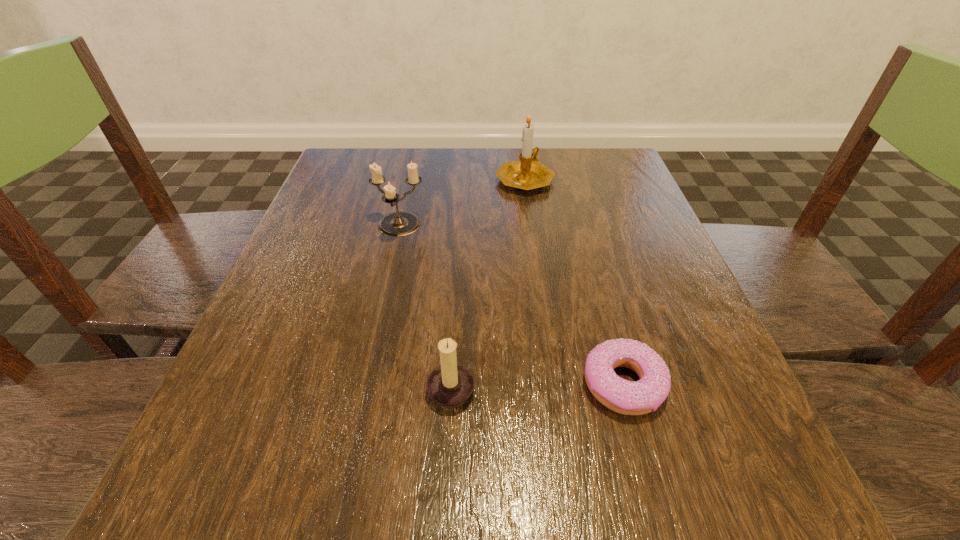
Identify the location of the tallest candle holder. The width and height of the screenshot is (960, 540). (526, 174).

The image size is (960, 540). Identify the location of the farthest candle holder. (526, 174).

Find the location of a particular element. Image resolution: width=960 pixels, height=540 pixels. the third shortest object is located at coordinates click(400, 223).

Where is `the second farthest object`? This screenshot has width=960, height=540. the second farthest object is located at coordinates (400, 223).

The height and width of the screenshot is (540, 960). In order to click on the second shortest object in this screenshot , I will do `click(451, 384)`.

Identify the location of the shortest candle holder. The width and height of the screenshot is (960, 540). (451, 384).

The width and height of the screenshot is (960, 540). In order to click on doughnut in this screenshot , I will do `click(640, 397)`.

This screenshot has height=540, width=960. I want to click on vacant space located on the front of the tallest object, so click(x=541, y=299).

Find the location of a particular element. free spot located 0.050m on the right of the third shortest object is located at coordinates (449, 226).

Where is `free space located 0.120m on the wick of the second shortest object`? free space located 0.120m on the wick of the second shortest object is located at coordinates (558, 386).